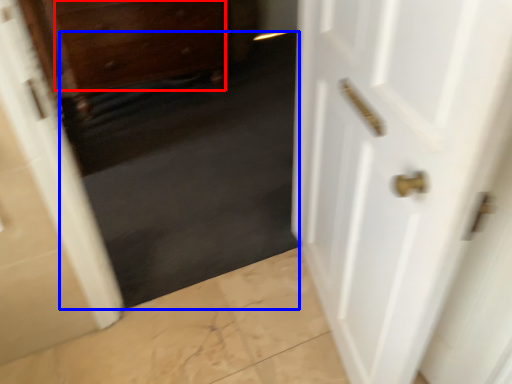
Question: Which object appears closest to the camera in this image, drawer (highlighted by a red box) or dark (highlighted by a blue box)?

Choices:
 (A) drawer
 (B) dark

Answer: (B)